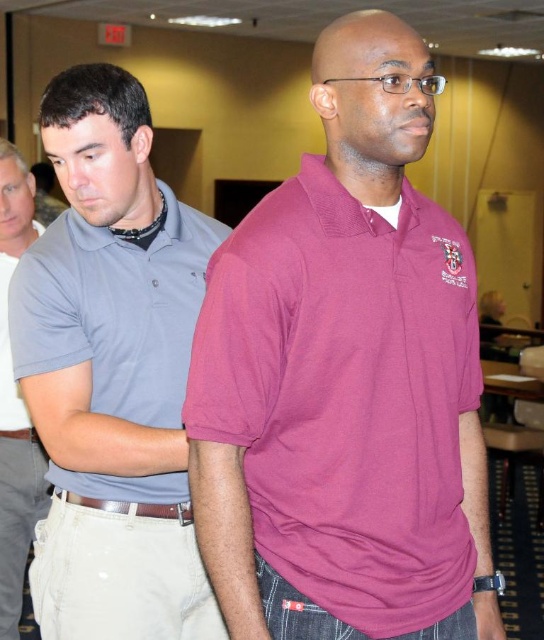
Question: Is burgundy pique polo shirt at center behind matte gray polo at center?

Choices:
 (A) yes
 (B) no

Answer: (B)

Question: Which of the following is the farthest from the observer?

Choices:
 (A) (1, 600)
 (B) (103, 273)
 (C) (374, 22)

Answer: (A)

Question: Does matte gray polo shirt at left appear on the left side of matte gray polo at center?

Choices:
 (A) no
 (B) yes

Answer: (A)

Question: In this image, where is burgundy pique polo shirt at center located relative to matte gray shirt at left?

Choices:
 (A) below
 (B) above

Answer: (B)

Question: Which object is positioned farthest from the matte gray polo at center?

Choices:
 (A) matte gray shirt at left
 (B) burgundy pique polo shirt at center

Answer: (B)

Question: Which point appears closest to the camera in this image?

Choices:
 (A) (127, 301)
 (B) (16, 404)
 (C) (436, 296)
 (D) (2, 566)

Answer: (C)